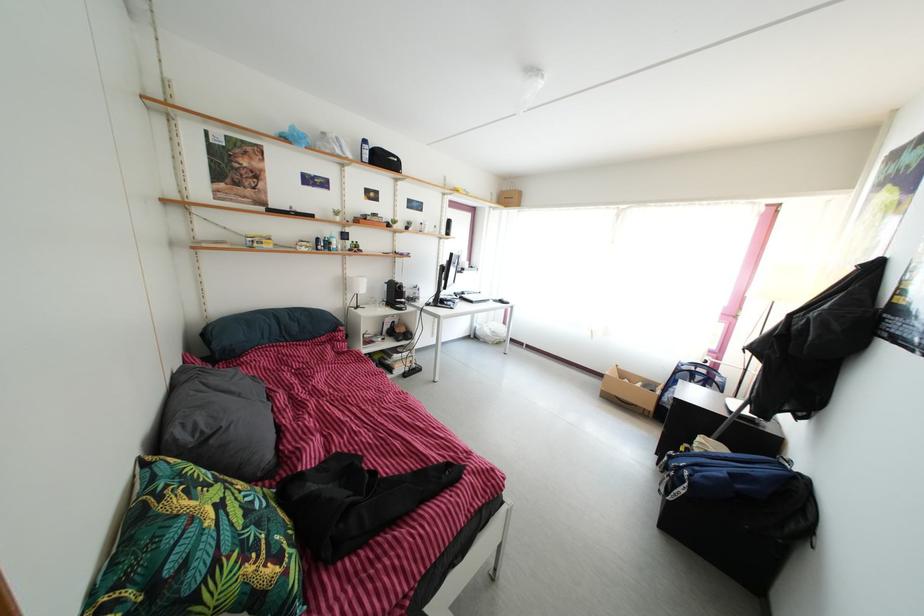
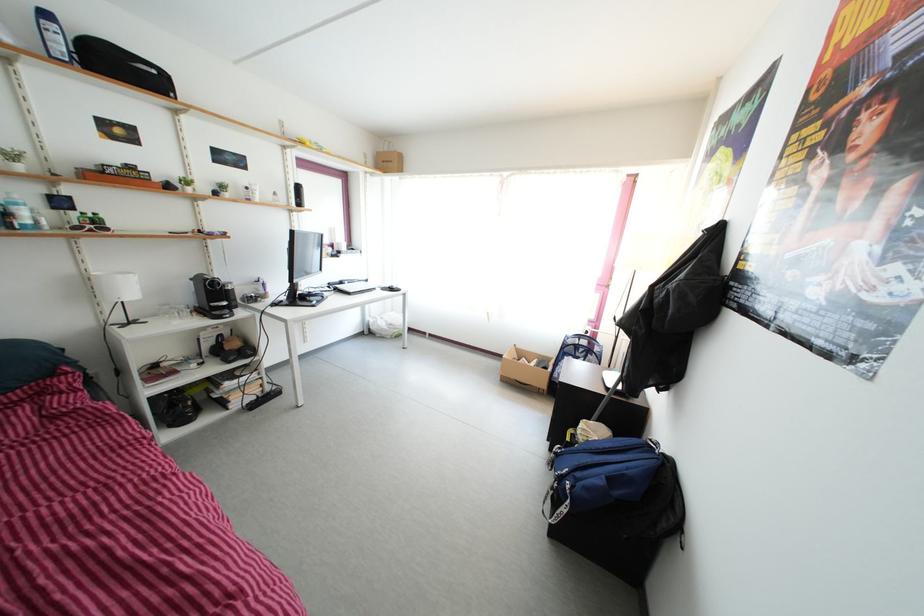
In a continuous first-person perspective shot, in which direction is the camera moving?

The cameraman moved toward right, forward.